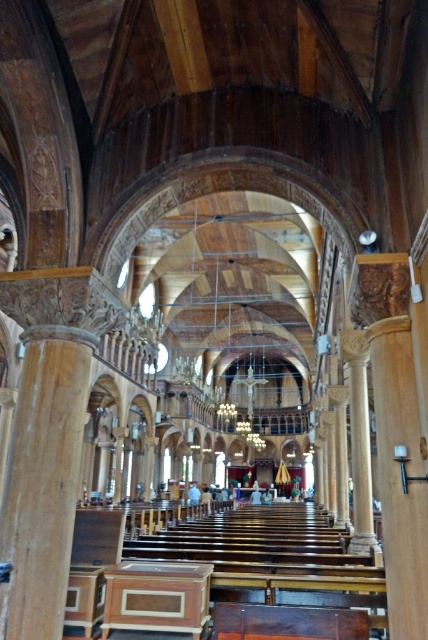
Can you confirm if polished wood column at center is smaller than wooden altar at center?

No, polished wood column at center is not smaller than wooden altar at center.

Who is higher up, polished wood column at center or wooden altar at center?

polished wood column at center is higher up.

Who is more forward, (51, 531) or (181, 579)?

Point (51, 531) is more forward.

The height and width of the screenshot is (640, 428). Find the location of `polished wood column at center`. polished wood column at center is located at coordinates [42, 481].

Who is higher up, polished wood column at center or wooden column at center?

Positioned higher is wooden column at center.

Who is lower down, polished wood column at center or wooden column at center?

Positioned lower is polished wood column at center.

Who is more distant from viewer, (41,588) or (419,499)?

The point (41,588) is more distant.

Image resolution: width=428 pixels, height=640 pixels. Find the location of `polished wood column at center`. polished wood column at center is located at coordinates [42, 481].

Which is above, wooden column at center or wooden altar at center?

wooden column at center

Image resolution: width=428 pixels, height=640 pixels. I want to click on wooden column at center, so click(x=400, y=476).